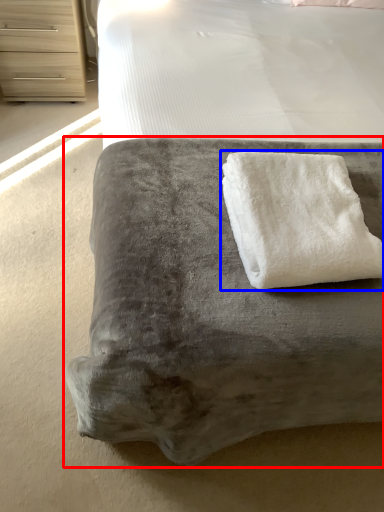
Question: Among these objects, which one is farthest to the camera, furniture (highlighted by a red box) or towel (highlighted by a blue box)?

Choices:
 (A) furniture
 (B) towel

Answer: (B)